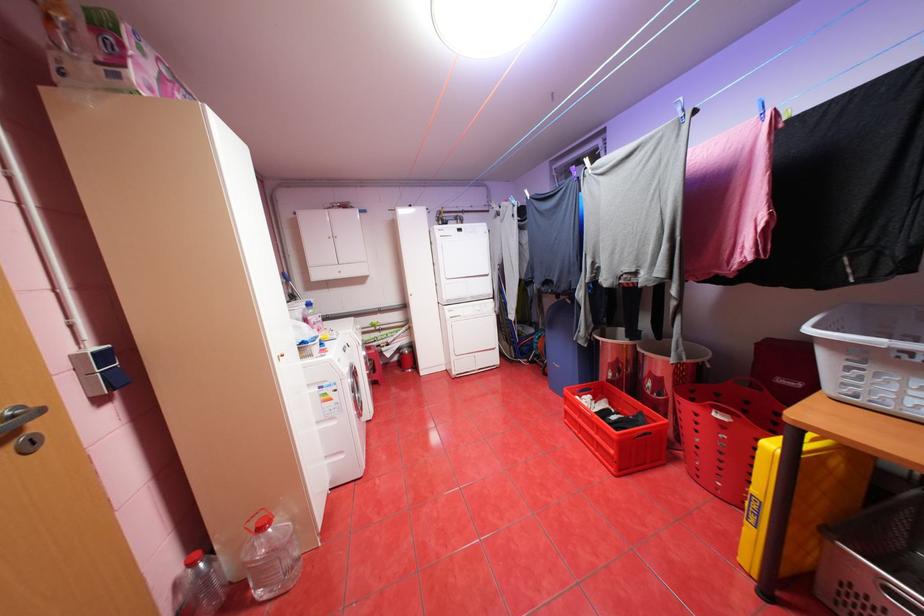
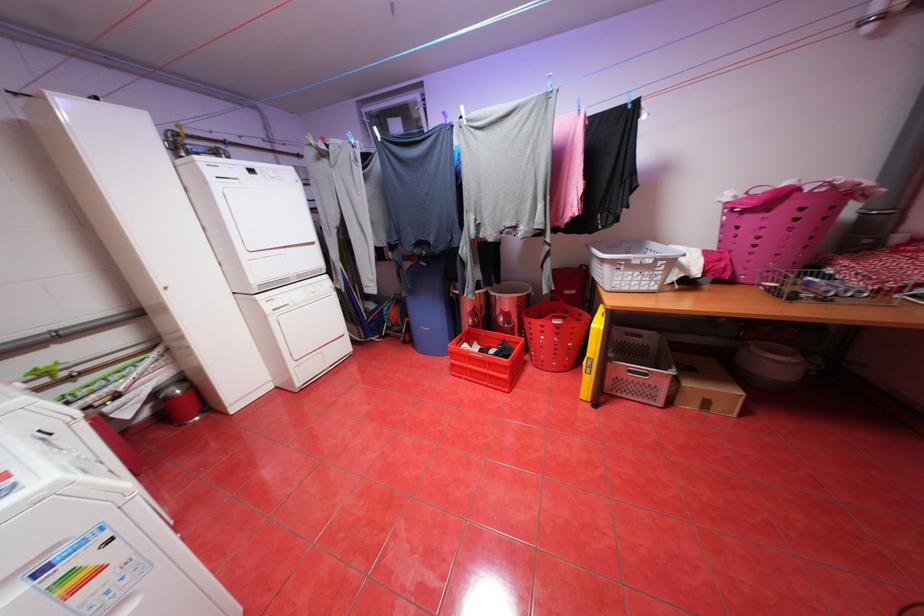
Where in the second image is the point corresponding to pixel 456 314 from the first image?

(275, 307)